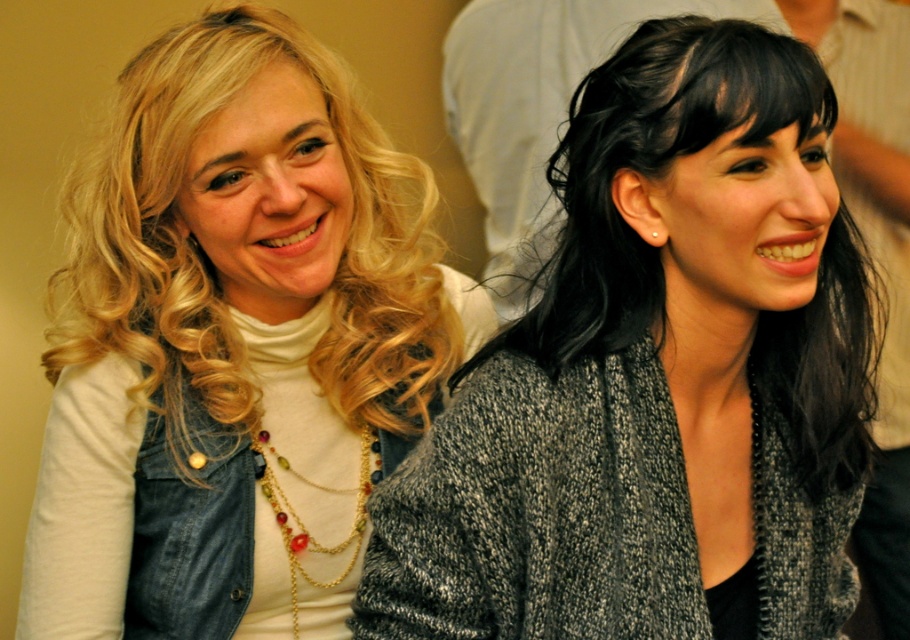
Does gray knitted sweater at center have a greater height compared to blonde curly hair at left?

Correct, gray knitted sweater at center is much taller as blonde curly hair at left.

Does gray knitted sweater at center appear over blonde curly hair at left?

Actually, gray knitted sweater at center is below blonde curly hair at left.

Who is more forward, (787, 296) or (207, 100)?

Point (787, 296) is in front.

The height and width of the screenshot is (640, 910). I want to click on gray knitted sweater at center, so click(656, 378).